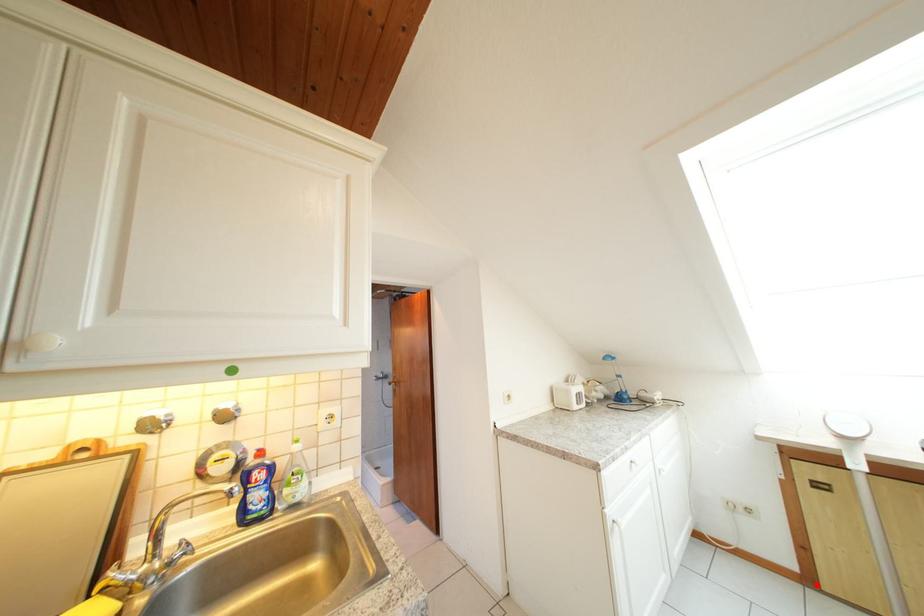
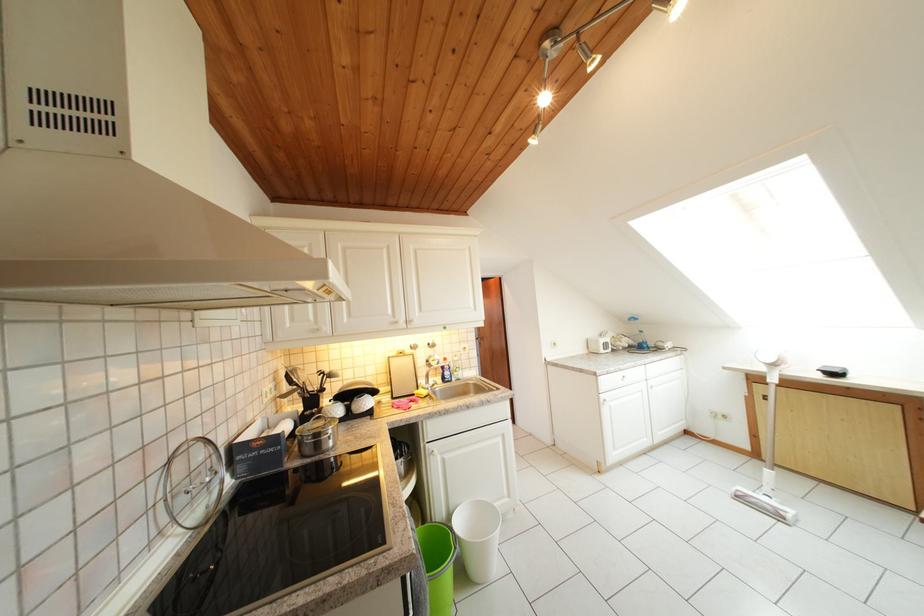
Question: I am providing you with two images of the same scene from different viewpoints. In image1, a red point is highlighted. Considering the same 3D point in image2, which of the following is correct?

Choices:
 (A) It is closer
 (B) It is farther

Answer: (A)